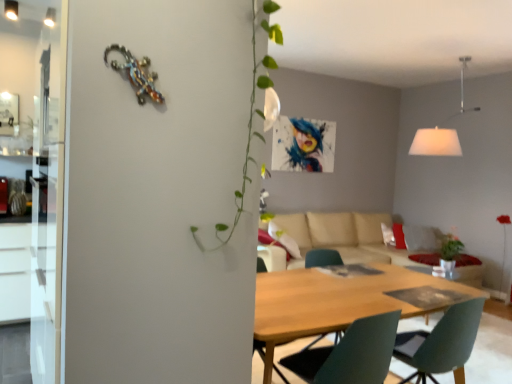
Find the location of a particular element. The image size is (512, 384). free space above wooden table at center (from a real-world perspective) is located at coordinates (351, 286).